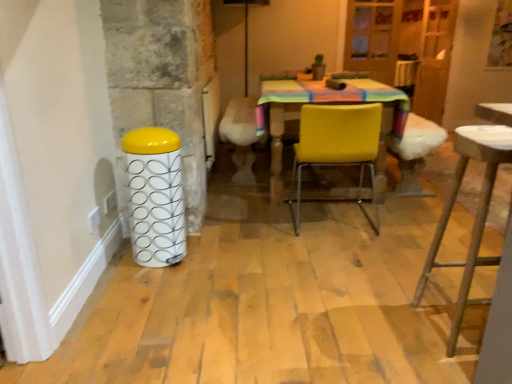
Identify the location of empty space that is to the right of yellow matte chair at center. The width and height of the screenshot is (512, 384). (396, 221).